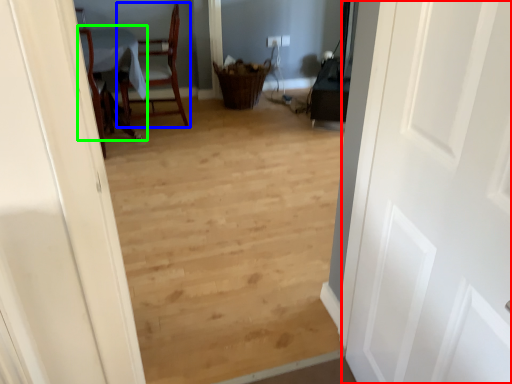
Question: Which object is positioned closest to door (highlighted by a red box)? Select from chair (highlighted by a blue box) and table (highlighted by a green box).

Choices:
 (A) chair
 (B) table

Answer: (B)